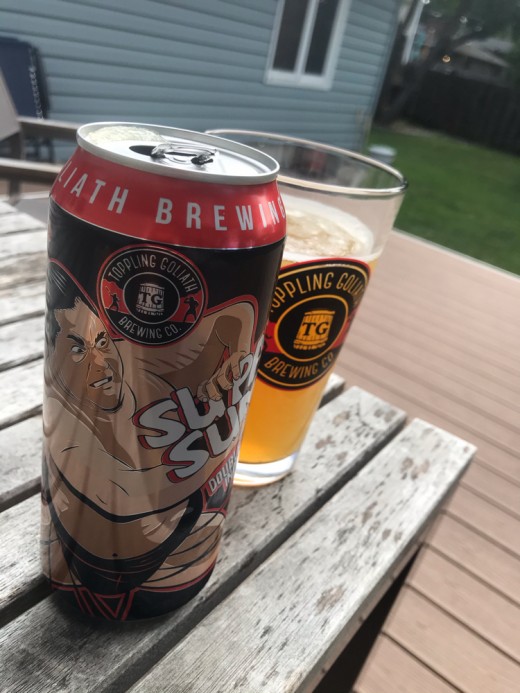
In order to click on window in this screenshot , I will do `click(293, 26)`.